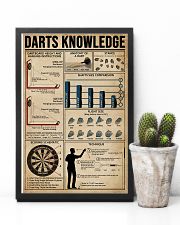
At what (x,y) coordinates should I click in order to perform the action: click on plant pot. Please return your answer as a coordinate pair (x, y). The image size is (180, 225). Looking at the image, I should click on (150, 175).